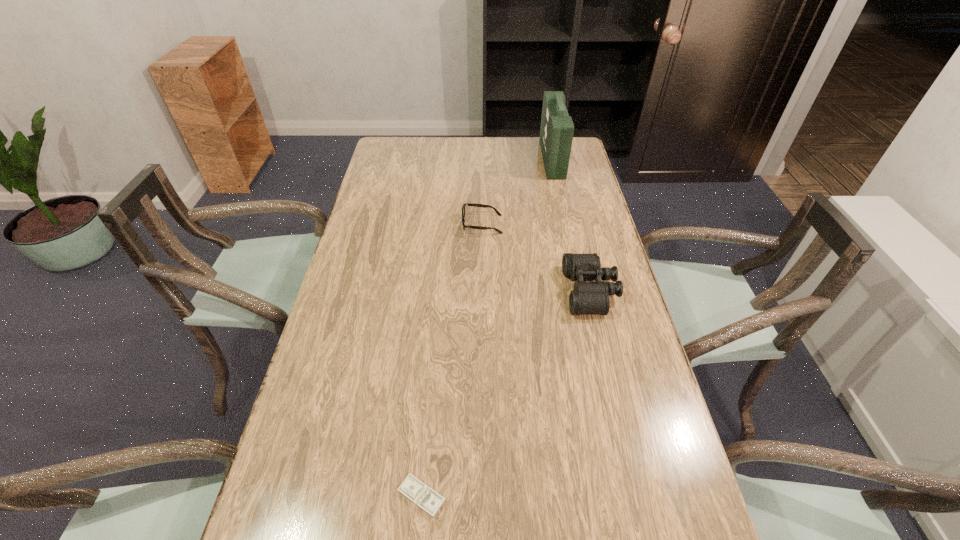
Find the location of a particular element. The width and height of the screenshot is (960, 540). binoculars located in the right edge section of the desktop is located at coordinates (588, 298).

The height and width of the screenshot is (540, 960). Find the location of `object at the far right corner`. object at the far right corner is located at coordinates (556, 132).

At what (x,y) coordinates should I click in order to perform the action: click on vacant space at the far edge. Please return your answer as a coordinate pair (x, y). Image resolution: width=960 pixels, height=540 pixels. Looking at the image, I should click on (504, 163).

In order to click on vacant space at the left edge of the desktop in this screenshot , I will do `click(380, 238)`.

Where is `free space at the right edge`? free space at the right edge is located at coordinates pyautogui.click(x=566, y=196).

Where is `vacant space at the far left corner`? vacant space at the far left corner is located at coordinates (415, 165).

Image resolution: width=960 pixels, height=540 pixels. Find the location of `vacant space at the far right corner of the desktop`. vacant space at the far right corner of the desktop is located at coordinates (583, 161).

At what (x,y) coordinates should I click in order to perform the action: click on free space between the second shortest object and the money. Please return your answer as a coordinate pair (x, y). The image size is (960, 540). Looking at the image, I should click on (452, 360).

This screenshot has width=960, height=540. I want to click on free space that is in between the second nearest object and the tallest object, so click(x=571, y=225).

You are a GUI agent. You are given a task and a screenshot of the screen. Output one action in this format:
    pyautogui.click(x=<x>, y=<y>)
    Task: Click on the empty space that is in between the money and the second shortest object
    This screenshot has width=960, height=540.
    Given the screenshot: What is the action you would take?
    pyautogui.click(x=452, y=360)